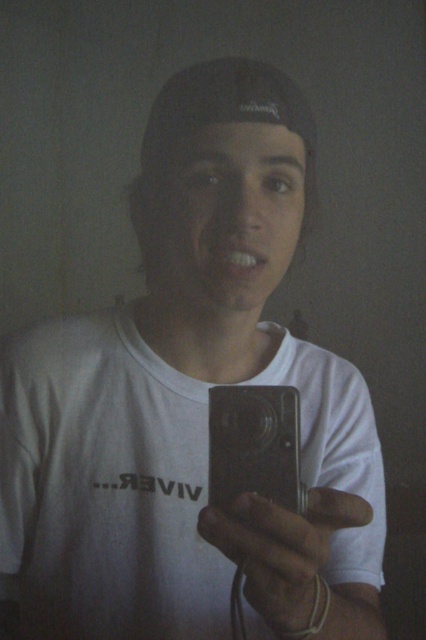
You are a photographer trying to adjust the lighting for a selfie. You notice a point at coordinates (282, 550) which marks the matte gray phone at center. Where should you position the light source to reduce shadows on the subject?

The point at coordinates (282, 550) marks the matte gray phone at center. To reduce shadows on the subject, position the light source opposite to the side where the shadows are cast. Since the shadows are on the subject, placing the light source facing the subject from the direction opposite to the shadows will help illuminate the area and minimize shadows.

You are taking a selfie with your matte gray phone at center and a satin silver camera at center. Which device is nearer to your face?

The matte gray phone at center is closer to the viewer than the satin silver camera at center, so the matte gray phone at center is nearer to your face.